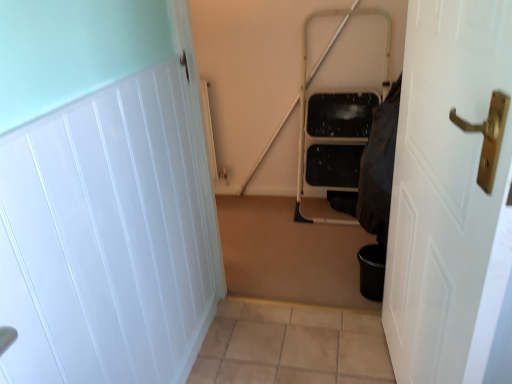
Locate an element on the screen. The height and width of the screenshot is (384, 512). vacant space that is to the left of black fabric at right is located at coordinates (329, 264).